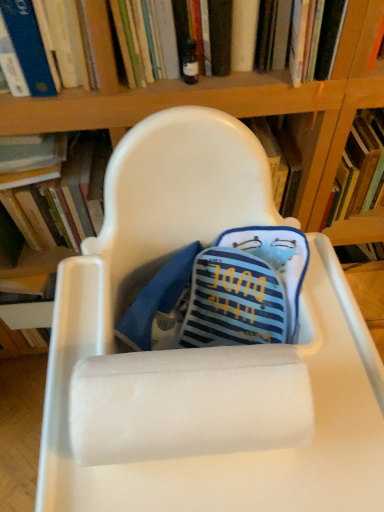
Identify the location of free location above white fluffy paper towel at center (from a real-world perspective). The width and height of the screenshot is (384, 512). (210, 377).